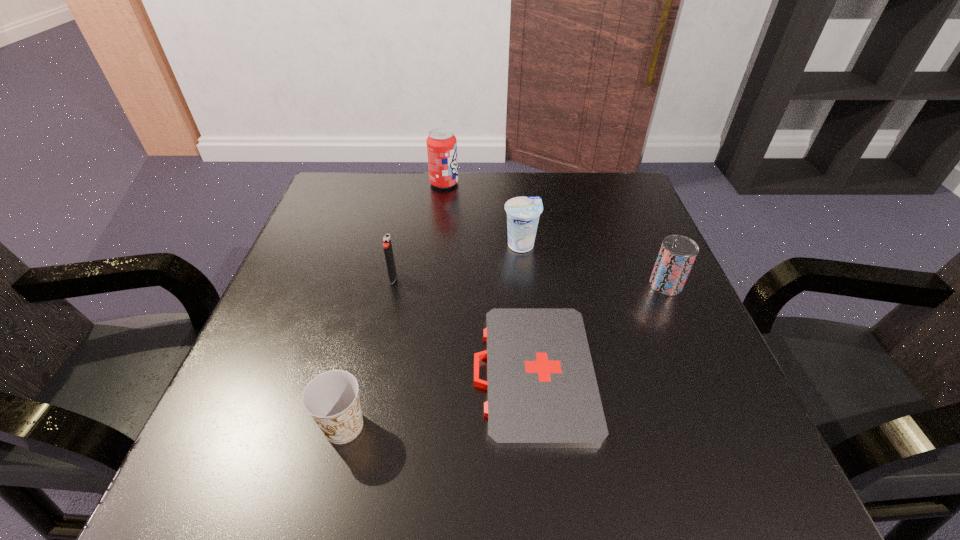
This screenshot has width=960, height=540. In order to click on soda can in this screenshot , I will do `click(441, 143)`.

Where is `the farthest object`? Image resolution: width=960 pixels, height=540 pixels. the farthest object is located at coordinates (441, 143).

Locate an element on the screen. The width and height of the screenshot is (960, 540). igniter is located at coordinates (387, 246).

Image resolution: width=960 pixels, height=540 pixels. Identify the location of the fifth nearest object. (523, 213).

At what (x,y) coordinates should I click in order to perform the action: click on beer can. Please return your answer as a coordinate pair (x, y). Looking at the image, I should click on (677, 254).

Identify the location of Dixie cup. (332, 399).

Find the location of a particular element. This screenshot has width=960, height=540. the shortest object is located at coordinates point(542,390).

Find the location of a particular element. This screenshot has width=960, height=540. vacant space located on the surface of the fourth object from right to left is located at coordinates (602, 183).

In order to click on vacant space located 0.120m on the left of the igniter in this screenshot , I will do `click(332, 278)`.

I want to click on vacant space situated on the right of the fifth nearest object, so click(639, 245).